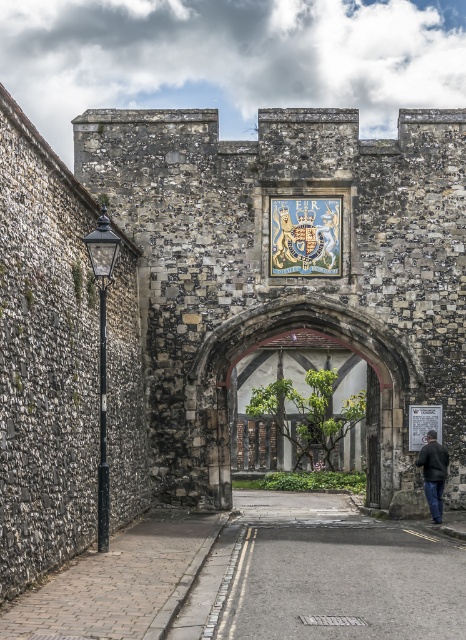
Question: Does brown wooden gate at center come behind dark gray jacket at center?

Choices:
 (A) no
 (B) yes

Answer: (B)

Question: Which of the following is the farthest from the observer?

Choices:
 (A) wooden at center
 (B) brown wooden gate at center

Answer: (B)

Question: Estimate the real-world distances between objects in this image. Which object is farther from the brown wooden gate at center?

Choices:
 (A) dark gray jacket at center
 (B) wooden at center

Answer: (A)

Question: Does brown wooden gate at center appear under wooden at center?

Choices:
 (A) no
 (B) yes

Answer: (A)

Question: Estimate the real-world distances between objects in this image. Which object is farther from the brown wooden gate at center?

Choices:
 (A) dark gray jacket at center
 (B) wooden at center

Answer: (A)

Question: Does wooden at center have a smaller size compared to dark gray jacket at center?

Choices:
 (A) yes
 (B) no

Answer: (B)